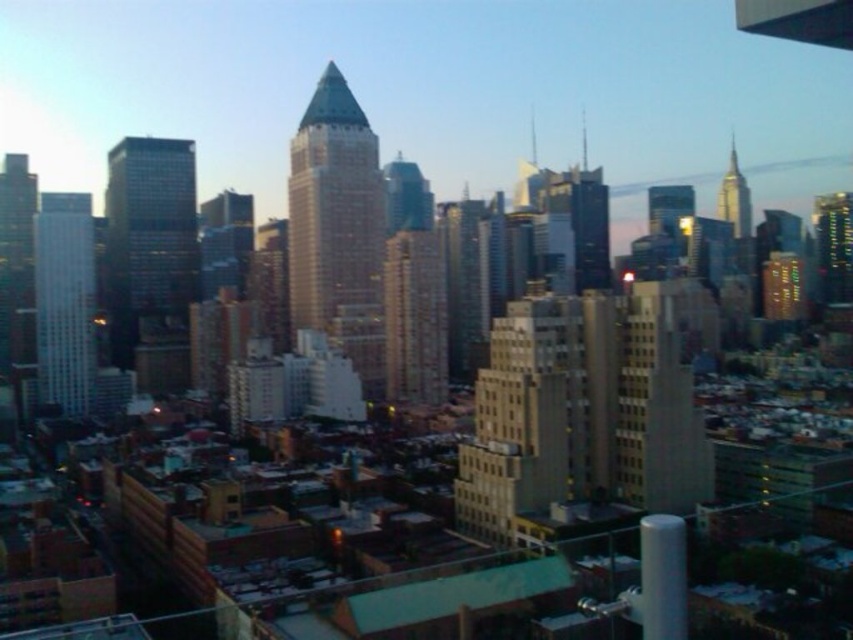
Question: Is sleek glass skyscraper at center below gold reflective spire at upper right?

Choices:
 (A) no
 (B) yes

Answer: (B)

Question: Can you confirm if sleek glass skyscraper at center is thinner than gold reflective spire at upper right?

Choices:
 (A) no
 (B) yes

Answer: (A)

Question: Can you confirm if sleek glass skyscraper at center is positioned to the left of gold reflective spire at upper right?

Choices:
 (A) yes
 (B) no

Answer: (A)

Question: Which is nearer to the sleek glass skyscraper at center?

Choices:
 (A) smooth glass skyscraper at left
 (B) gold reflective spire at upper right

Answer: (A)

Question: Among these points, which one is farthest from the camera?

Choices:
 (A) (65, 296)
 (B) (306, 252)
 (C) (735, 214)

Answer: (C)

Question: Which point appears closest to the camera in this image?

Choices:
 (A) (82, 204)
 (B) (355, 344)

Answer: (B)